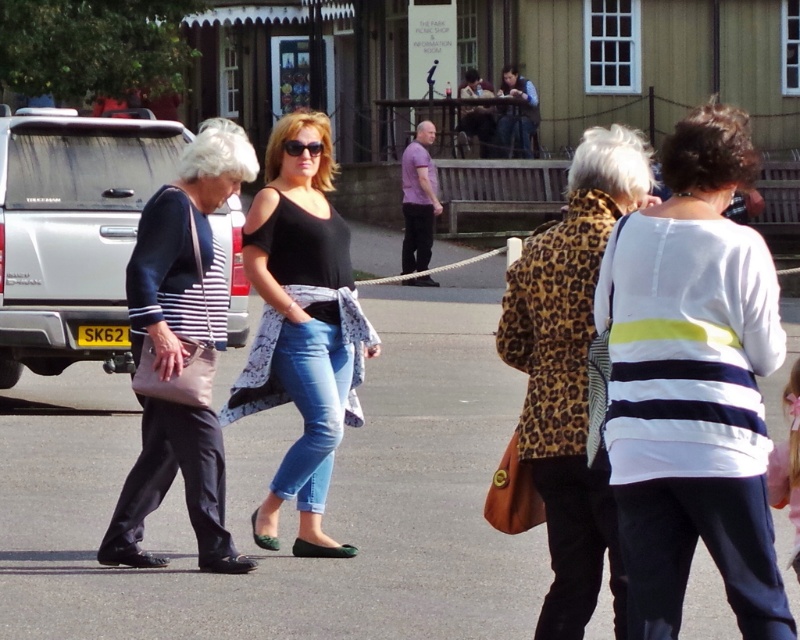
You are a photographer trying to capture a candid shot of both the matte black jacket at left and the purple matte shirt at center. Since you want to ensure both subjects are in focus, you need to know which one is wider to adjust your camera settings. Which object has a greater width?

The matte black jacket at left has a greater width than the purple matte shirt at center.

You are a pedestrian standing on the sidewalk and see the silver metallic pickup truck at left and the purple matte shirt at center. Which object is positioned lower in the image?

The silver metallic pickup truck at left is located below purple matte shirt at center, so it is positioned lower in the image.

You are a photographer trying to capture a photo of the matte black jacket at left and the purple matte shirt at center in the street scene. Based on their positions, which one would appear closer to the bottom of the photo?

The matte black jacket at left is located below the purple matte shirt at center, so it would appear closer to the bottom of the photo.